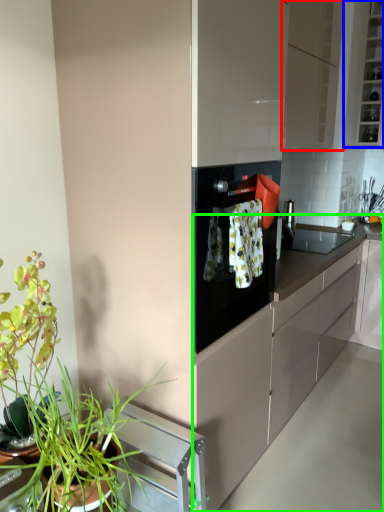
Question: Which object is positioned closest to cabinetry (highlighted by a red box)? Select from cabinetry (highlighted by a blue box) and countertop (highlighted by a green box).

Choices:
 (A) cabinetry
 (B) countertop

Answer: (A)